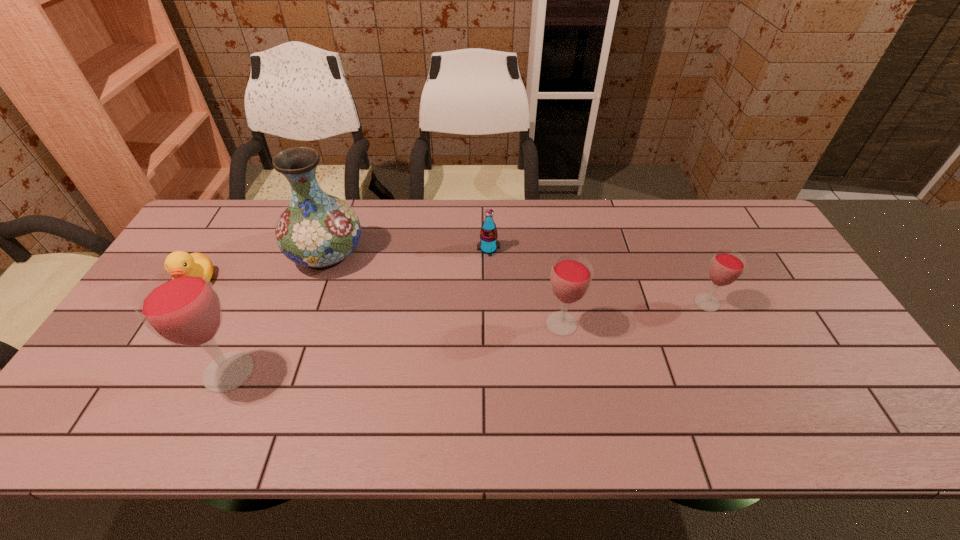
I want to click on vacant area that lies between the third object from right to left and the vase, so click(x=407, y=251).

Locate an element on the screen. The image size is (960, 540). free space between the vase and the fourth object from left to right is located at coordinates (407, 251).

The image size is (960, 540). I want to click on vacant point located between the nearest wineglass and the rightmost wineglass, so click(468, 338).

At what (x,y) coordinates should I click in order to perform the action: click on object that is the fourth nearest to the vase. Please return your answer as a coordinate pair (x, y). Looking at the image, I should click on (571, 275).

Locate which object is the fifth closest to the third object from right to left. Please provide its 2D coordinates. Your answer should be formatted as a tuple, i.e. [(x, y)], where the tuple contains the x and y coordinates of a point satisfying the conditions above.

[(176, 259)]

This screenshot has height=540, width=960. What are the coordinates of `wineglass that stands as the closest to the vase` in the screenshot? It's located at (181, 306).

Find the location of `wineglass that is the closest to the vase`. wineglass that is the closest to the vase is located at coordinates (181, 306).

You are a GUI agent. You are given a task and a screenshot of the screen. Output one action in this format:
    pyautogui.click(x=<x>, y=<y>)
    Task: Click on the free point that satisfies the following two spatial constraints: 1. on the back side of the second shortest wineglass; 2. on the left side of the nearest wineglass
    
    Given the screenshot: What is the action you would take?
    pyautogui.click(x=251, y=324)

The height and width of the screenshot is (540, 960). In order to click on vacant space that satisfies the following two spatial constraints: 1. at the beak of the shortest object; 2. on the left side of the leftmost wineglass in this screenshot , I will do `click(143, 372)`.

You are a GUI agent. You are given a task and a screenshot of the screen. Output one action in this format:
    pyautogui.click(x=<x>, y=<y>)
    Task: Click on the vacant point that satisfies the following two spatial constraints: 1. at the beak of the shortest object; 2. on the right side of the shortest wineglass
    This screenshot has height=540, width=960.
    Given the screenshot: What is the action you would take?
    pyautogui.click(x=185, y=303)